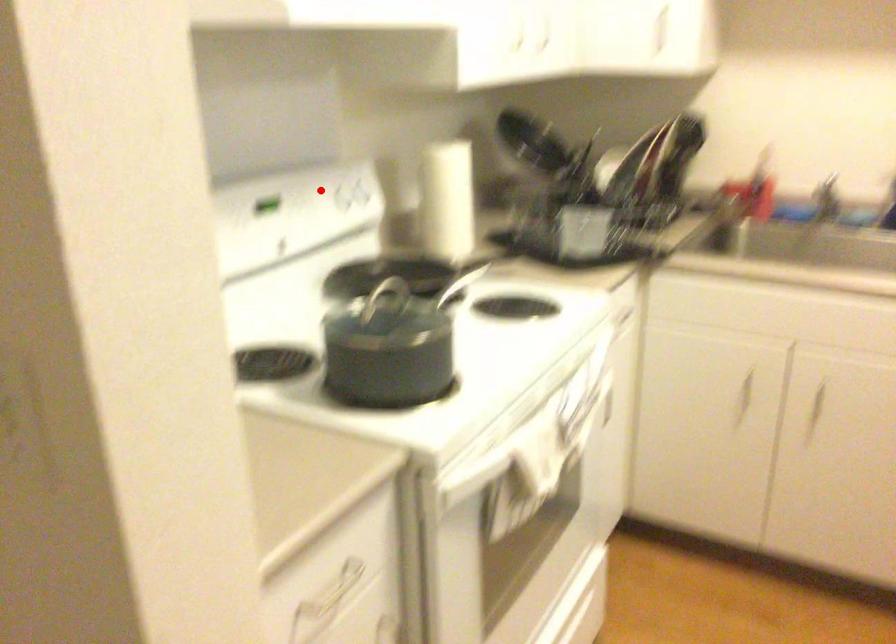
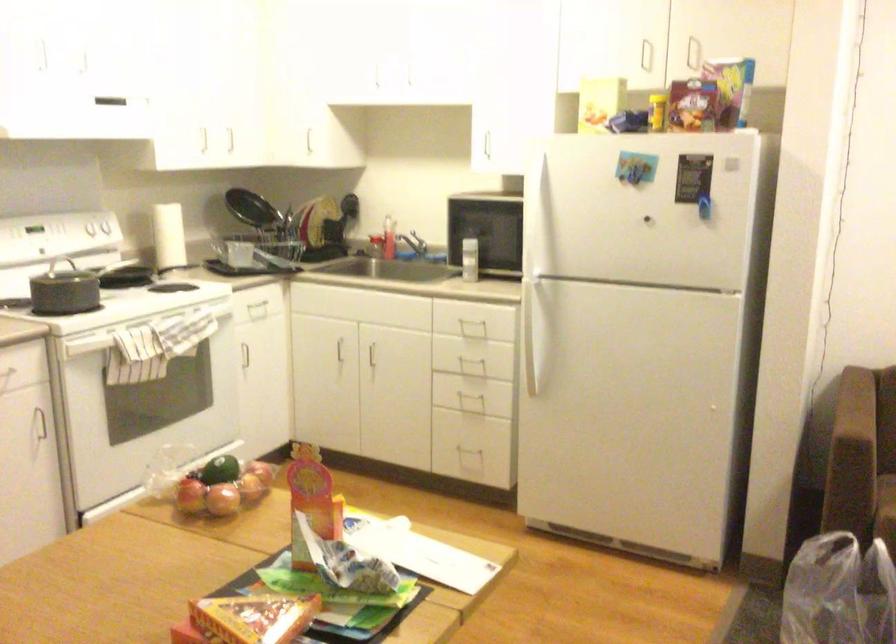
Question: A red point is marked in image1. In image2, is the corresponding 3D point closer to the camera or farther? Reply with the corresponding letter.

Choices:
 (A) The corresponding 3D point is closer.
 (B) The corresponding 3D point is farther.

Answer: (B)